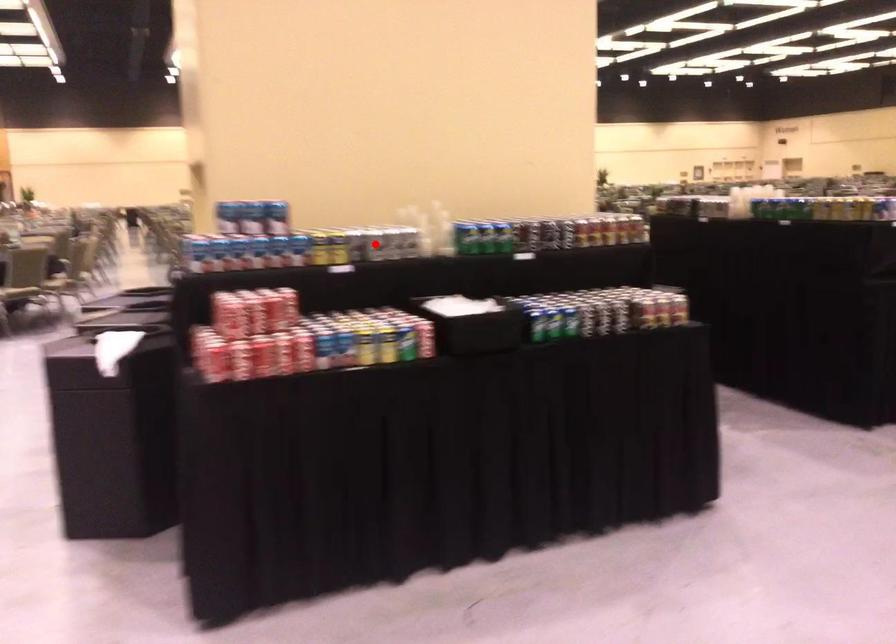
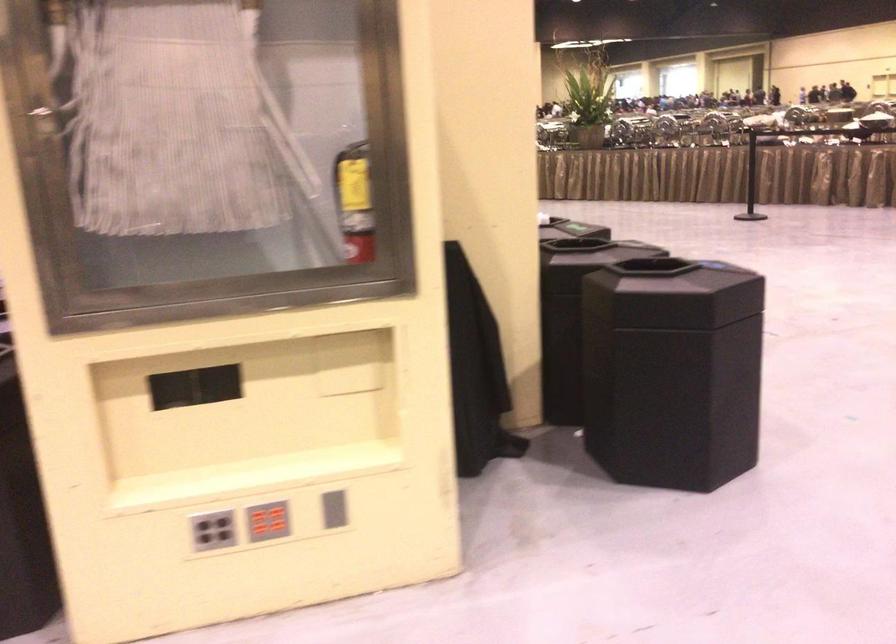
Question: I am providing you with two images of the same scene from different viewpoints. A red point is marked on the first image. At the location where the point appears in image 1, is it still visible in image 2?

Choices:
 (A) Yes
 (B) No

Answer: (B)